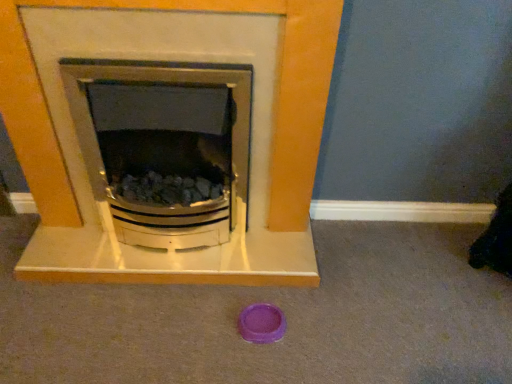
Find the location of a particular element. vacant space to the right of matte white fireplace at center is located at coordinates (369, 292).